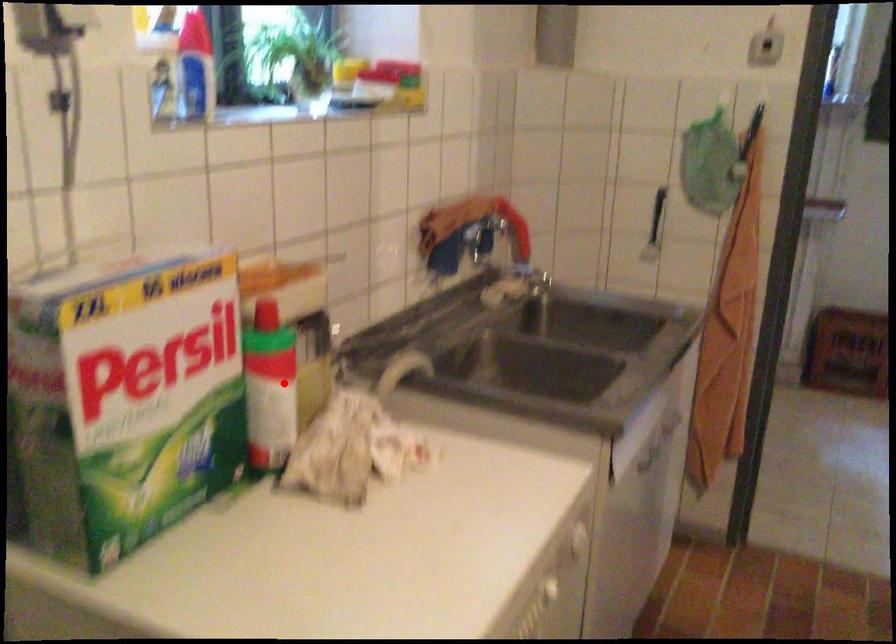
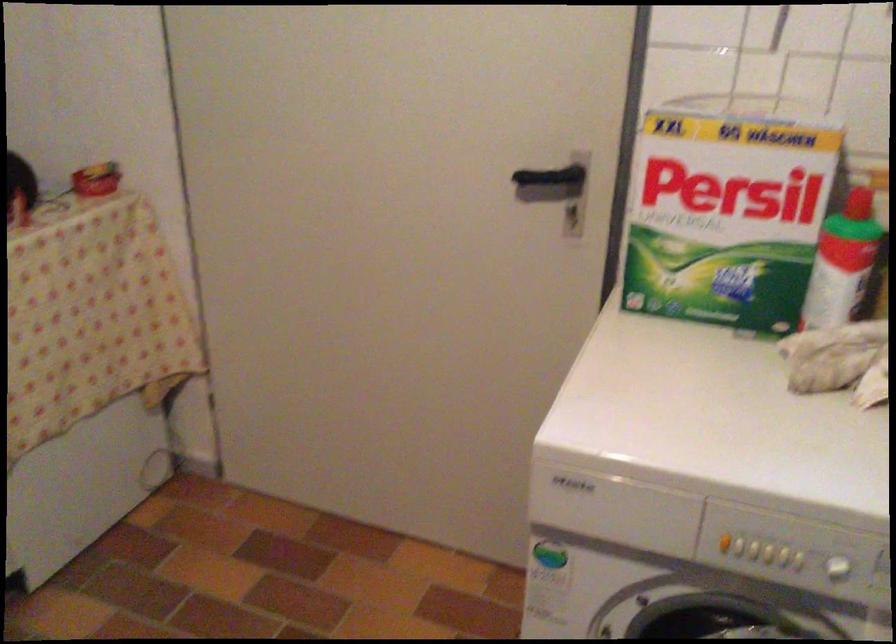
Locate, in the second image, the point that corresponds to the highlighted location in the first image.

(842, 263)